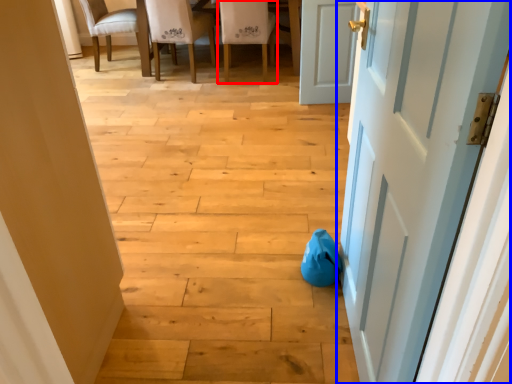
Question: Which of the following is the closest to the observer, chair (highlighted by a red box) or door (highlighted by a blue box)?

Choices:
 (A) chair
 (B) door

Answer: (B)